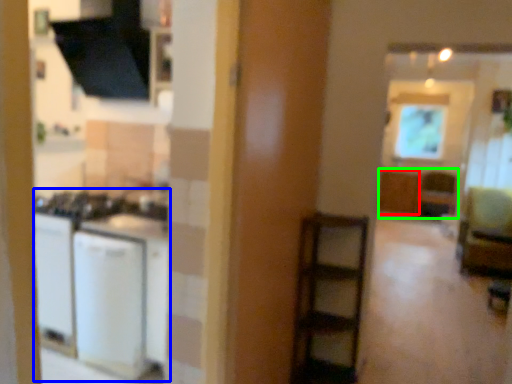
Question: Which object is positioned farthest from cabinetry (highlighted by a red box)? Select from appliance (highlighted by a blue box) and cabinetry (highlighted by a green box).

Choices:
 (A) appliance
 (B) cabinetry

Answer: (A)